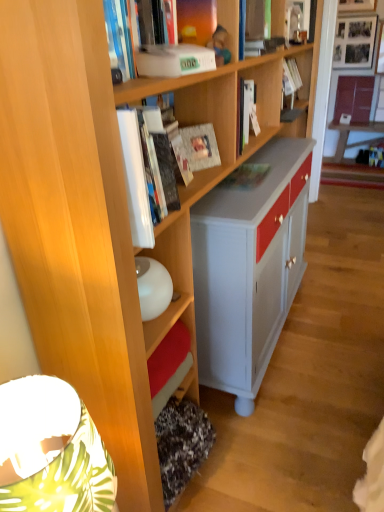
Question: Which direction should I rotate to face white matte paperback book at upper center, the 2th paperback book viewed from the back, — up or down?

Choices:
 (A) up
 (B) down

Answer: (A)

Question: Can you confirm if white matte paperback book at upper center, which is counted as the first paperback book, starting from the front, is bigger than white glossy cabinet at upper right?

Choices:
 (A) no
 (B) yes

Answer: (A)

Question: Is white matte paperback book at upper center, the 2th paperback book viewed from the back, shorter than white glossy cabinet at upper right?

Choices:
 (A) no
 (B) yes

Answer: (B)

Question: Considering the relative positions of white matte paperback book at upper center, which is counted as the first paperback book, starting from the front, and white glossy cabinet at upper right in the image provided, is white matte paperback book at upper center, which is counted as the first paperback book, starting from the front, to the left of white glossy cabinet at upper right from the viewer's perspective?

Choices:
 (A) yes
 (B) no

Answer: (A)

Question: Is white matte paperback book at upper center, the 2th paperback book viewed from the back, closer to camera compared to white glossy cabinet at upper right?

Choices:
 (A) no
 (B) yes

Answer: (B)

Question: Is white matte paperback book at upper center, the 2th paperback book viewed from the back, placed right next to white glossy cabinet at upper right?

Choices:
 (A) no
 (B) yes

Answer: (A)

Question: From a real-world perspective, does white matte paperback book at upper center, the 2th paperback book viewed from the back, sit lower than white glossy cabinet at upper right?

Choices:
 (A) yes
 (B) no

Answer: (B)

Question: Is matte paper at center, the second paperback book positioned from the front, positioned in front of white glossy book at upper center, the 1th book positioned from the front?

Choices:
 (A) no
 (B) yes

Answer: (A)

Question: Is matte paper at center, the second paperback book positioned from the front, smaller than white glossy book at upper center, the 1th book positioned from the front?

Choices:
 (A) no
 (B) yes

Answer: (B)

Question: Is matte paper at center, which is counted as the 1th paperback book, starting from the back, oriented away from white glossy book at upper center, which is counted as the 2th book, starting from the bottom?

Choices:
 (A) yes
 (B) no

Answer: (B)

Question: From the image's perspective, does matte paper at center, which is counted as the 1th paperback book, starting from the back, appear higher than white glossy book at upper center, the first book positioned from the left?

Choices:
 (A) yes
 (B) no

Answer: (B)

Question: Can you confirm if matte paper at center, the second paperback book positioned from the front, is thinner than white glossy book at upper center, the 1th book positioned from the front?

Choices:
 (A) no
 (B) yes

Answer: (B)

Question: From a real-world perspective, is matte paper at center, which is counted as the 1th paperback book, starting from the back, physically above white glossy book at upper center, positioned as the 4th book in top-to-bottom order?

Choices:
 (A) no
 (B) yes

Answer: (A)

Question: Can you confirm if matte brown book at upper right, which is counted as the 1th book, starting from the back, is positioned to the right of matte green book at center, arranged as the 5th book when viewed from the top?

Choices:
 (A) no
 (B) yes

Answer: (B)